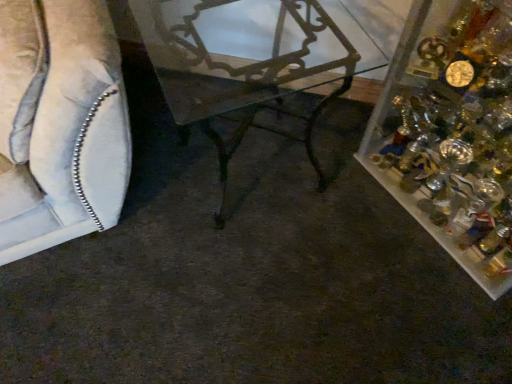
Question: In terms of size, does suede-like beige sofa at left appear bigger or smaller than clear plastic container at right?

Choices:
 (A) small
 (B) big

Answer: (B)

Question: Considering the positions of suede-like beige sofa at left and clear plastic container at right in the image, is suede-like beige sofa at left taller or shorter than clear plastic container at right?

Choices:
 (A) tall
 (B) short

Answer: (A)

Question: Based on their relative distances, which object is farther from the metallic wrought iron table at center?

Choices:
 (A) clear plastic container at right
 (B) suede-like beige sofa at left

Answer: (A)

Question: Which of these objects is positioned closest to the suede-like beige sofa at left?

Choices:
 (A) metallic wrought iron table at center
 (B) clear plastic container at right

Answer: (A)